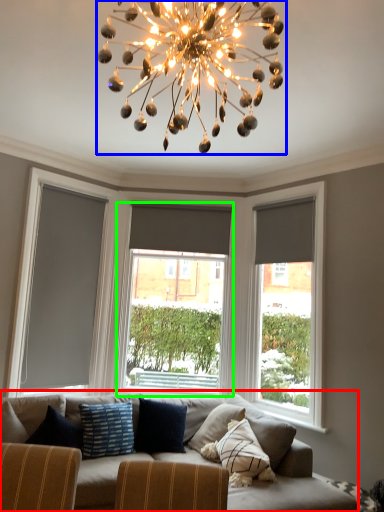
Question: Considering the real-world distances, which object is farthest from studio couch (highlighted by a red box)? chandelier (highlighted by a blue box) or window (highlighted by a green box)?

Choices:
 (A) chandelier
 (B) window

Answer: (A)